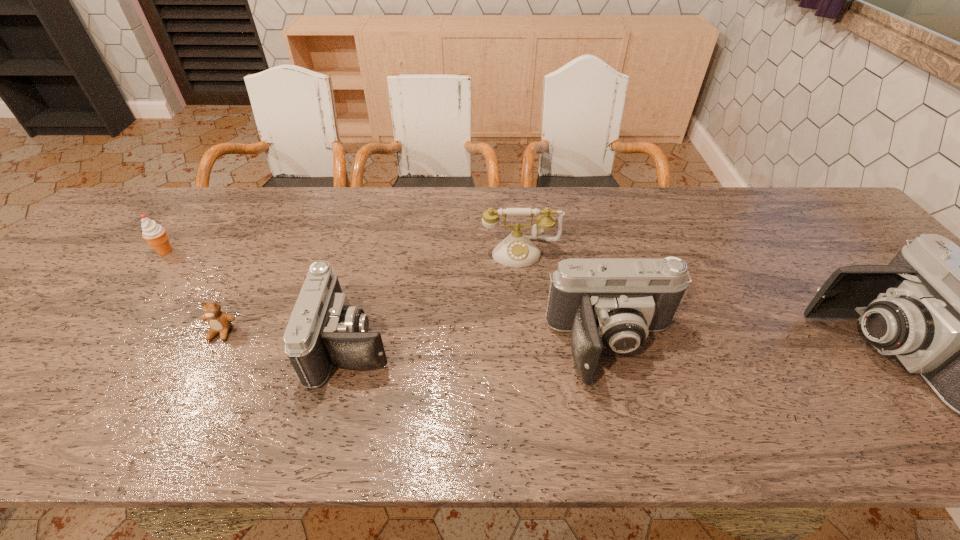
Point out which object is positioned as the nearest to the second tallest object. Please provide its 2D coordinates. Your answer should be formatted as a tuple, i.e. [(x, y)], where the tuple contains the x and y coordinates of a point satisfying the conditions above.

[(516, 250)]

Point out which camera is positioned as the nearest to the rightmost camera. Please provide its 2D coordinates. Your answer should be formatted as a tuple, i.e. [(x, y)], where the tuple contains the x and y coordinates of a point satisfying the conditions above.

[(614, 303)]

Locate an element on the screen. camera that stands as the closest to the second camera from left to right is located at coordinates (959, 316).

This screenshot has width=960, height=540. I want to click on free region that satisfies the following two spatial constraints: 1. on the dial of the telephone; 2. at the front of the shortest camera with an open lens cover, so (530, 343).

Identify the location of free spot that satisfies the following two spatial constraints: 1. on the dial of the telephone; 2. at the front of the leftmost camera with an open lens cover. Image resolution: width=960 pixels, height=540 pixels. (530, 343).